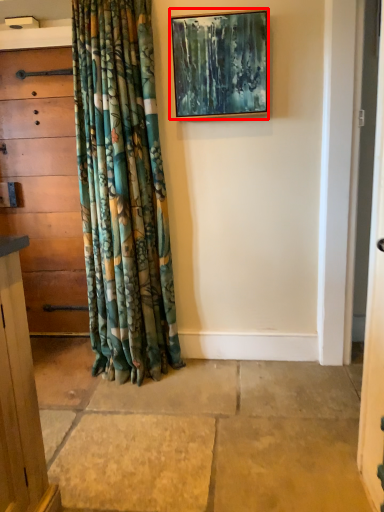
Question: From the image's perspective, what is the correct spatial relationship of picture frame (annotated by the red box) in relation to chest of drawers?

Choices:
 (A) below
 (B) above

Answer: (B)